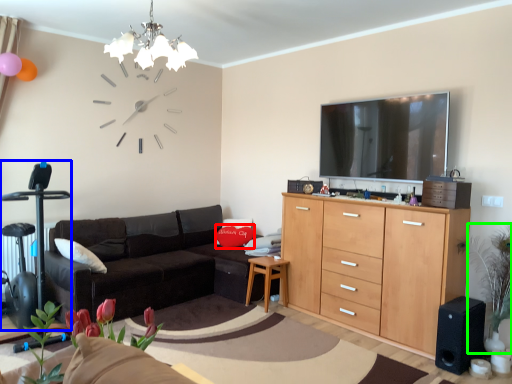
Question: Estimate the real-world distances between objects in this image. Which object is farther from flower (highlighted by a red box), swivel chair (highlighted by a blue box) or plant (highlighted by a green box)?

Choices:
 (A) swivel chair
 (B) plant

Answer: (B)